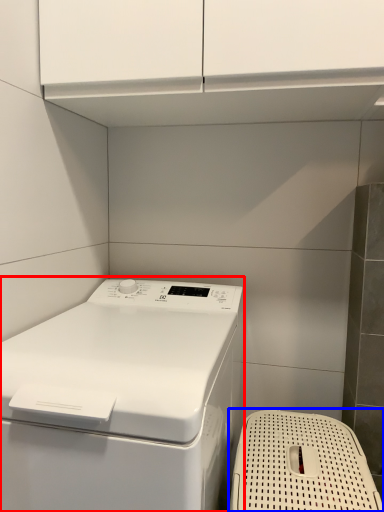
Question: Which object is closer to the camera taking this photo, home appliance (highlighted by a red box) or dish washer (highlighted by a blue box)?

Choices:
 (A) home appliance
 (B) dish washer

Answer: (A)